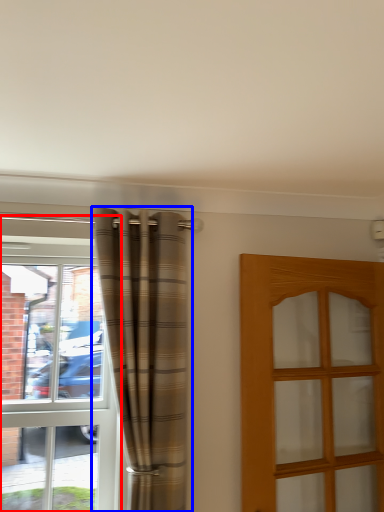
Question: Which point is further to the camera, window (highlighted by a red box) or curtain (highlighted by a blue box)?

Choices:
 (A) window
 (B) curtain

Answer: (A)